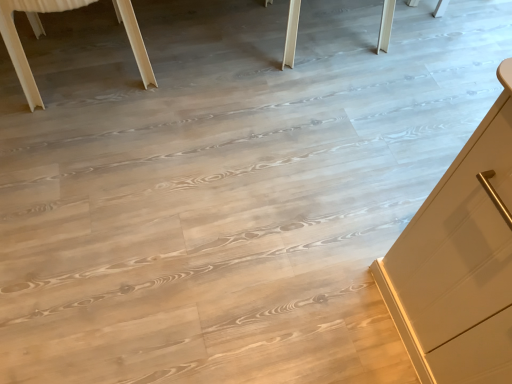
Locate an element on the screen. The width and height of the screenshot is (512, 384). vacant area to the right of light wood table at upper left is located at coordinates (x=182, y=79).